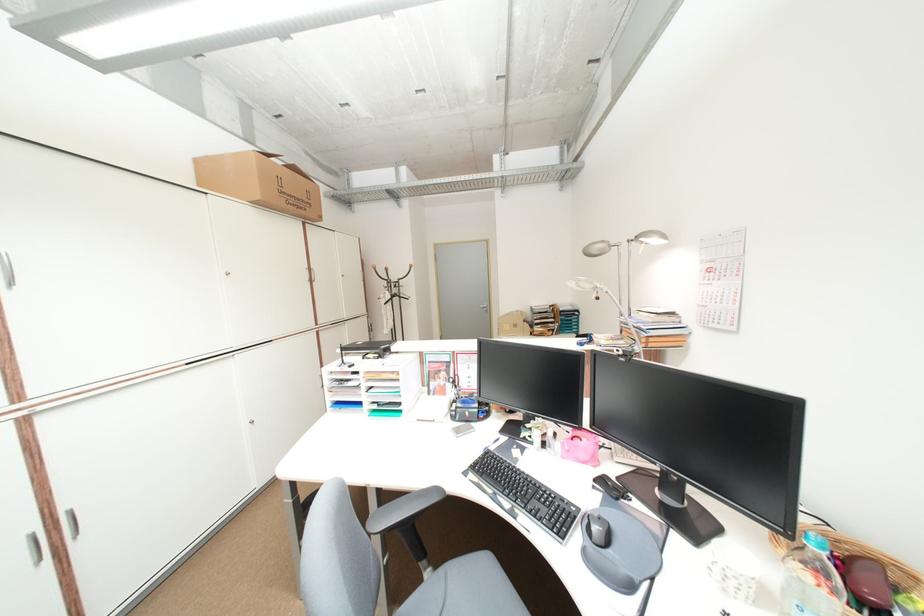
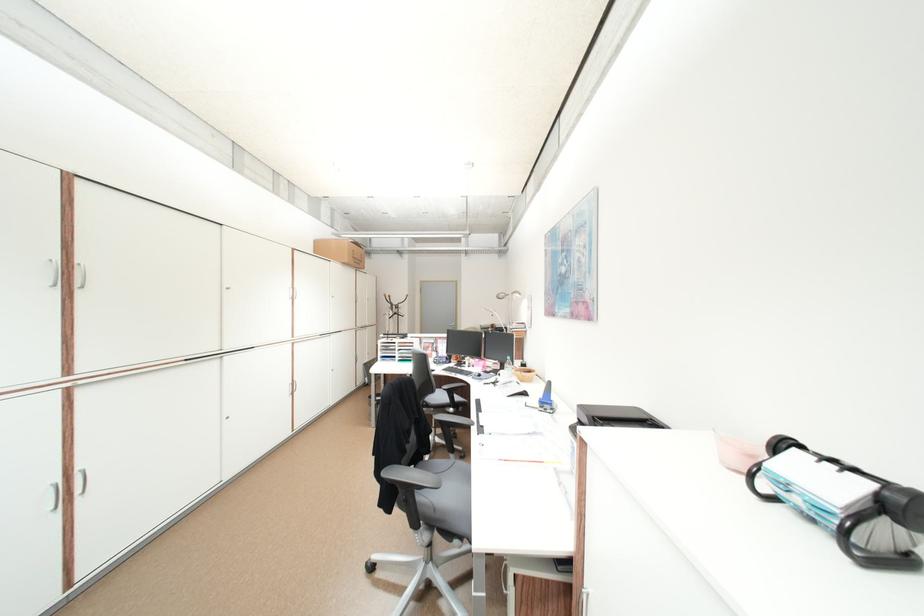
Locate, in the second image, the point that corresponds to point (266, 197) in the first image.

(356, 262)